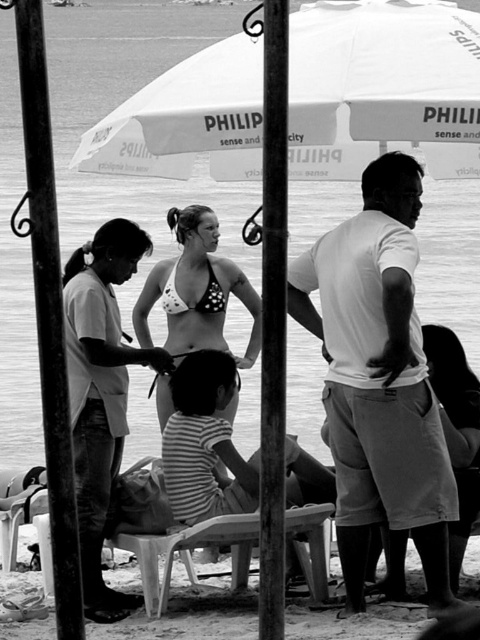
Which is behind, point (103, 540) or point (256, 305)?

Point (256, 305)

Between point (83, 461) and point (205, 237), which one is positioned in front?

Point (83, 461) is more forward.

Identify the location of matte white bikini at center. (100, 394).

Does white cotton shirt at right have a lesser height compared to matte white bikini at center?

No.

Image resolution: width=480 pixels, height=640 pixels. In order to click on white cotton shirt at right in this screenshot , I will do `click(379, 380)`.

Does point (228, 49) lie behind point (192, 336)?

No, (228, 49) is in front of (192, 336).

Does point (359, 148) come closer to viewer compared to point (157, 394)?

Yes, it is.

Does point (354, 1) come closer to viewer compared to point (176, 298)?

Yes, it is in front of point (176, 298).

The height and width of the screenshot is (640, 480). In order to click on white fabric umbrella at upper center in this screenshot , I will do `click(383, 84)`.